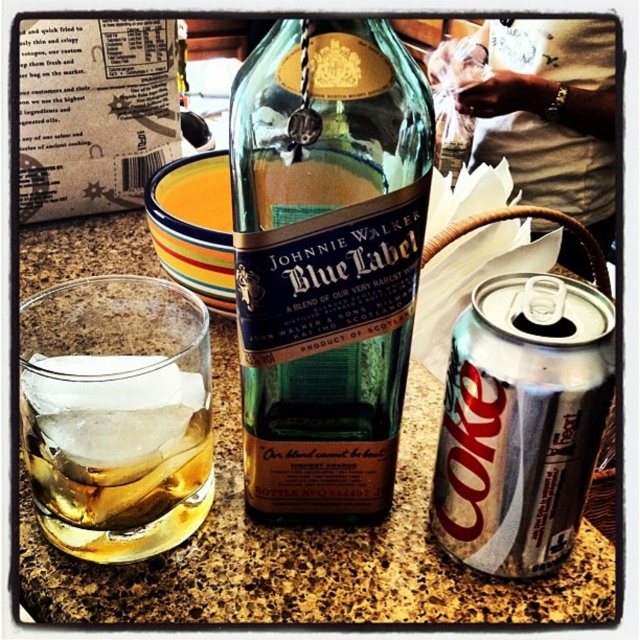
You are a bartender who needs to place a coaster at point (332, 452) to prevent the glass from slipping. The coaster has a diameter of 4 inches. Will the coaster fit without overlapping the edge of the counter?

The distance between point (332, 452) and the camera is 11.37 inches. Since the coaster has a diameter of 4 inches, it will fit as long as there is enough space around the point. However, the description does not provide information about the counter edges, so we cannot confirm if it will overlap.

You are standing at the center of the counter and want to place a new item at the point with coordinates point (326, 260). What object is currently occupying that location?

The point (326, 260) corresponds to the green glass bottle at center, so that location is currently occupied by the green glass bottle at center.

Please identify the object located at the coordinates point (x=326, y=260) in the scene described. The scene includes a green glass bottle at center, a glass with whisky and ice to its left, and a can of Coca Cola.

The point (x=326, y=260) marks the green glass bottle at center.